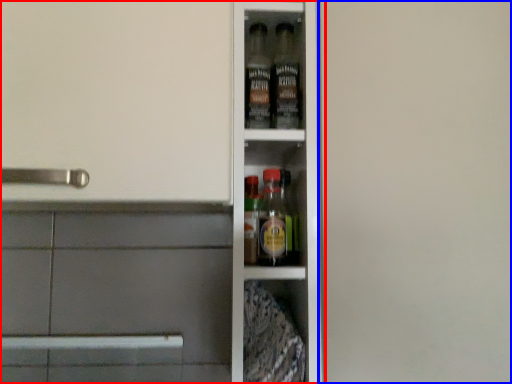
Question: Which of the following is the farthest to the observer, shelf (highlighted by a red box) or screen door (highlighted by a blue box)?

Choices:
 (A) shelf
 (B) screen door

Answer: (A)